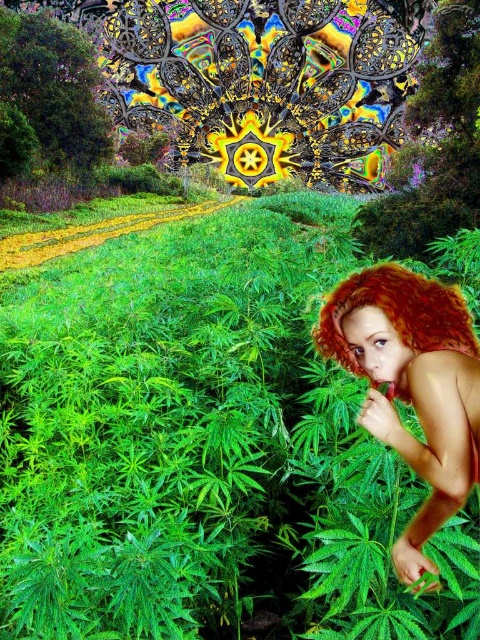
Question: Which object is closer to the camera taking this photo?

Choices:
 (A) green leafy grass at center
 (B) shiny red hair at right
 (C) vibrant red hair at right

Answer: (A)

Question: Does shiny red hair at right lie in front of vibrant red hair at right?

Choices:
 (A) yes
 (B) no

Answer: (A)

Question: Is shiny red hair at right below vibrant red hair at right?

Choices:
 (A) no
 (B) yes

Answer: (B)

Question: Is green leafy grass at center above shiny red hair at right?

Choices:
 (A) yes
 (B) no

Answer: (A)

Question: Which point is farther to the camera?

Choices:
 (A) (356, 358)
 (B) (437, 376)
 (C) (24, 445)

Answer: (A)

Question: Which object appears closest to the camera in this image?

Choices:
 (A) green leafy grass at center
 (B) vibrant red hair at right
 (C) shiny red hair at right

Answer: (A)